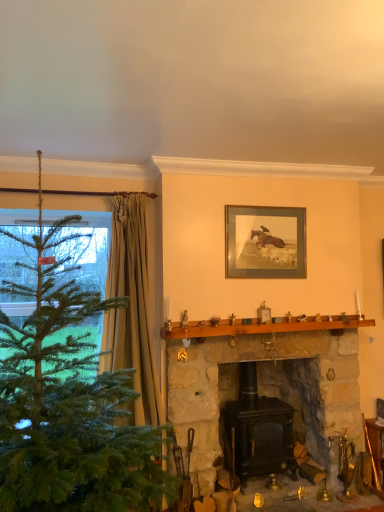
Question: Can wooden fireplace tools at lower right be found inside wooden frame at upper center?

Choices:
 (A) yes
 (B) no

Answer: (B)

Question: Could you tell me if wooden frame at upper center is facing wooden fireplace tools at lower right?

Choices:
 (A) no
 (B) yes

Answer: (A)

Question: Is wooden frame at upper center wider than wooden fireplace tools at lower right?

Choices:
 (A) no
 (B) yes

Answer: (A)

Question: Can you confirm if wooden frame at upper center is thinner than wooden fireplace tools at lower right?

Choices:
 (A) no
 (B) yes

Answer: (B)

Question: Considering the relative sizes of wooden frame at upper center and wooden fireplace tools at lower right in the image provided, is wooden frame at upper center shorter than wooden fireplace tools at lower right?

Choices:
 (A) yes
 (B) no

Answer: (B)

Question: From the image's perspective, does wooden frame at upper center appear lower than wooden fireplace tools at lower right?

Choices:
 (A) yes
 (B) no

Answer: (B)

Question: Can you confirm if brown wooden mantle at center is thinner than green matte christmas tree at left?

Choices:
 (A) yes
 (B) no

Answer: (A)

Question: Considering the relative sizes of brown wooden mantle at center and green matte christmas tree at left in the image provided, is brown wooden mantle at center taller than green matte christmas tree at left?

Choices:
 (A) no
 (B) yes

Answer: (A)

Question: Considering the relative positions of brown wooden mantle at center and green matte christmas tree at left in the image provided, is brown wooden mantle at center to the left of green matte christmas tree at left from the viewer's perspective?

Choices:
 (A) no
 (B) yes

Answer: (A)

Question: Is brown wooden mantle at center positioned far away from green matte christmas tree at left?

Choices:
 (A) yes
 (B) no

Answer: (A)

Question: Is brown wooden mantle at center wider than green matte christmas tree at left?

Choices:
 (A) no
 (B) yes

Answer: (A)

Question: From the image's perspective, is brown wooden mantle at center located above green matte christmas tree at left?

Choices:
 (A) yes
 (B) no

Answer: (A)

Question: Is the depth of black matte wood stove at center, acting as the second fireplace starting from the left, less than that of wooden frame at upper center?

Choices:
 (A) yes
 (B) no

Answer: (B)